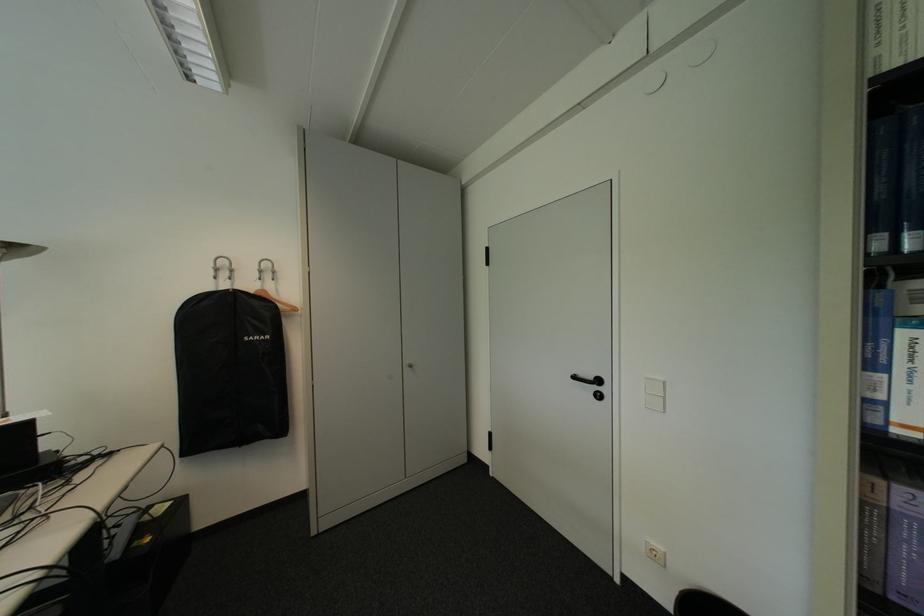
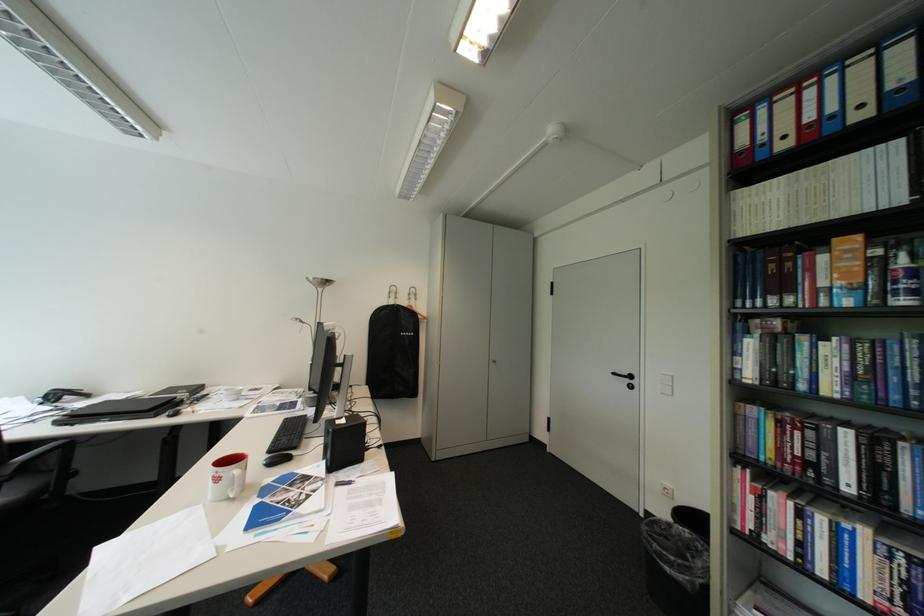
Find the pixel in the second image that matches the point at 587,378 in the first image.

(626, 374)